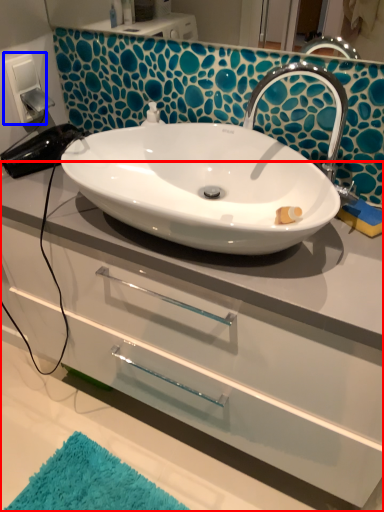
Question: Which of the following is the closest to the observer, bathroom cabinet (highlighted by a red box) or electric outlet (highlighted by a blue box)?

Choices:
 (A) bathroom cabinet
 (B) electric outlet

Answer: (A)